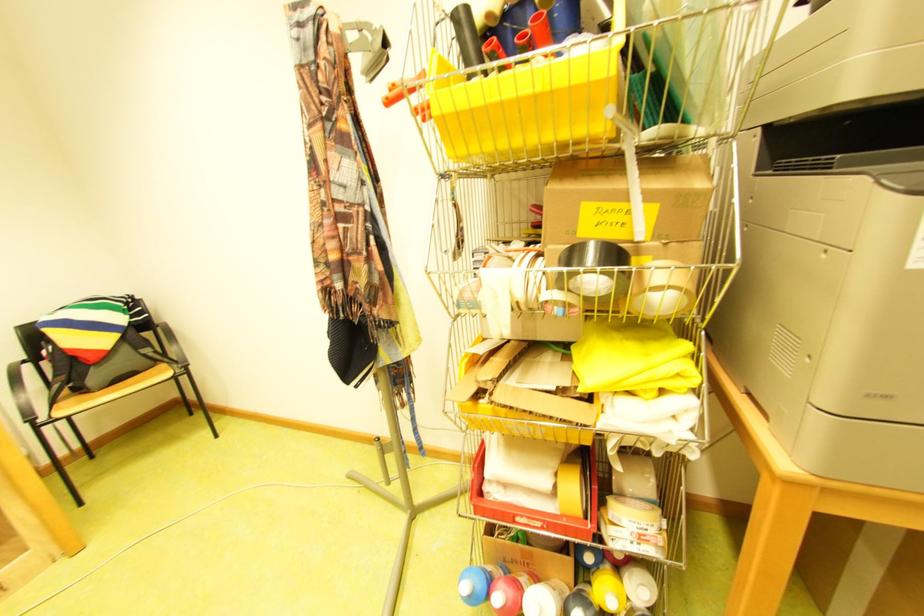
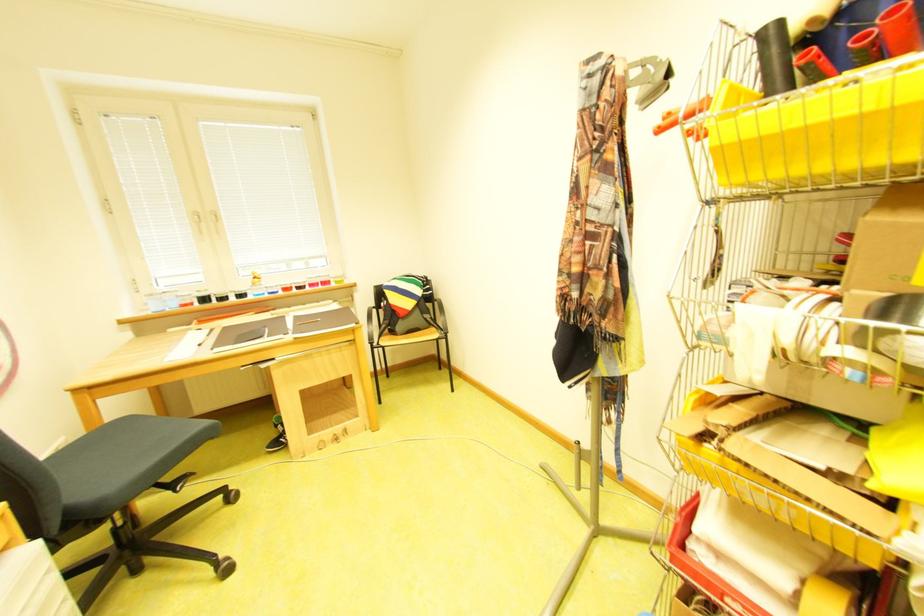
Where in the second image is the point corresponding to the point at 361,39 from the first image?

(646, 74)